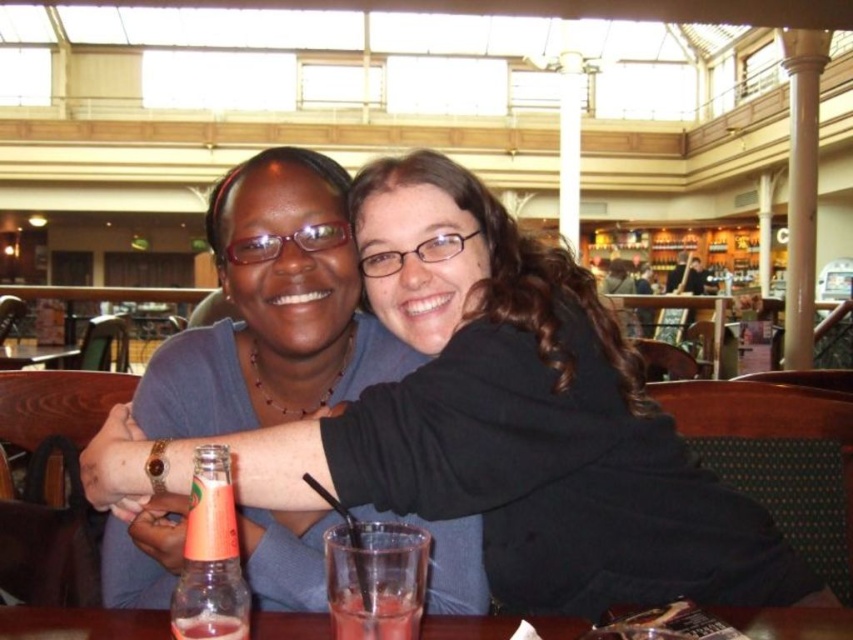
Question: Estimate the real-world distances between objects in this image. Which object is farther from the transparent glass at lower center?

Choices:
 (A) translucent glass at table center
 (B) translucent glass beverage at table front
 (C) translucent glass bottle at lower left

Answer: (B)

Question: Does matte blue shirt at center appear on the right side of translucent glass at lower center?

Choices:
 (A) no
 (B) yes

Answer: (A)

Question: Does matte blue shirt at center appear on the left side of translucent glass at lower center?

Choices:
 (A) no
 (B) yes

Answer: (B)

Question: Which of the following is the farthest from the observer?

Choices:
 (A) translucent glass bottle at lower left
 (B) translucent glass at table center
 (C) translucent glass beverage at table front

Answer: (B)

Question: Among these points, which one is nearest to the camera?

Choices:
 (A) (357, 534)
 (B) (186, 380)
 (C) (416, 627)
 (D) (310, 636)

Answer: (C)

Question: Does matte blue shirt at center appear under translucent glass beverage at table front?

Choices:
 (A) yes
 (B) no

Answer: (B)